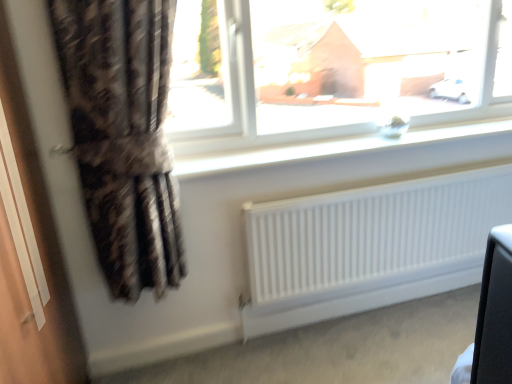
Where is `free space above white smooth window sill at upper center (from a real-world perspective)`? Image resolution: width=512 pixels, height=384 pixels. free space above white smooth window sill at upper center (from a real-world perspective) is located at coordinates [x=338, y=145].